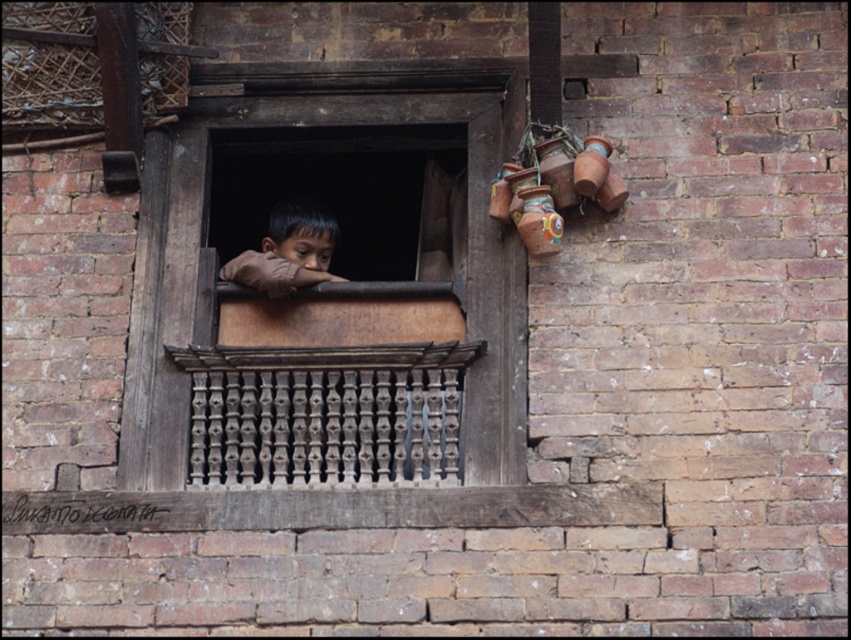
Question: Is dark brown wood at center below brown leather child at center?

Choices:
 (A) no
 (B) yes

Answer: (B)

Question: Does dark brown wood at center have a larger size compared to brown leather child at center?

Choices:
 (A) yes
 (B) no

Answer: (A)

Question: Does dark brown wood at center appear under brown leather child at center?

Choices:
 (A) yes
 (B) no

Answer: (A)

Question: Which point is closer to the camera?

Choices:
 (A) (307, 230)
 (B) (341, 84)

Answer: (B)